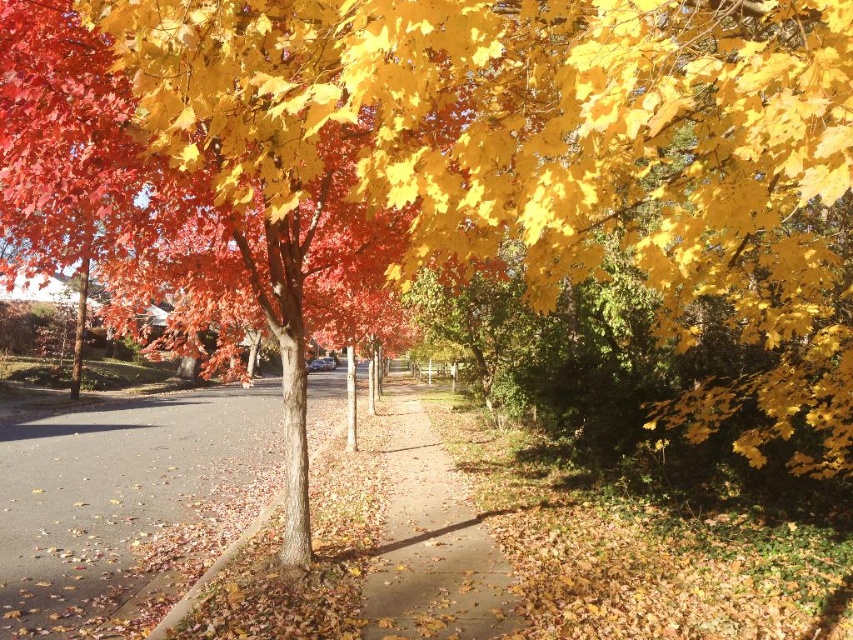
Question: Can you confirm if brown asphalt at lower left is smaller than brown dirt path at center?

Choices:
 (A) yes
 (B) no

Answer: (B)

Question: Which point is closer to the camera?

Choices:
 (A) brown asphalt at lower left
 (B) brown dirt path at center

Answer: (B)

Question: Does brown asphalt at lower left appear on the left side of brown dirt path at center?

Choices:
 (A) no
 (B) yes

Answer: (B)

Question: Is brown asphalt at lower left smaller than brown dirt path at center?

Choices:
 (A) yes
 (B) no

Answer: (B)

Question: Which of the following is the closest to the observer?

Choices:
 (A) (430, 611)
 (B) (250, 433)

Answer: (A)